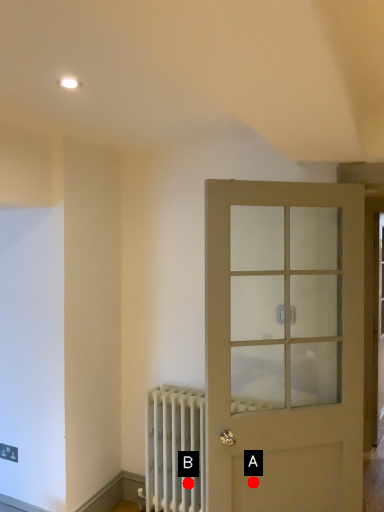
Question: Two points are circled on the image, labeled by A and B beside each circle. Which of the following is the closest to the observer?

Choices:
 (A) A is closer
 (B) B is closer

Answer: (A)